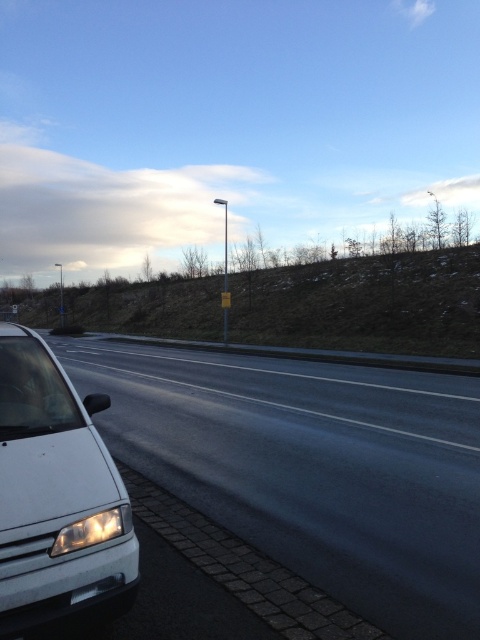
Is black asphalt highway at left further to camera compared to white matte van at left?

No, black asphalt highway at left is in front of white matte van at left.

Identify the location of black asphalt highway at left. The height and width of the screenshot is (640, 480). click(312, 467).

What do you see at coordinates (312, 467) in the screenshot? Image resolution: width=480 pixels, height=640 pixels. I see `black asphalt highway at left` at bounding box center [312, 467].

The image size is (480, 640). I want to click on black asphalt highway at left, so click(x=312, y=467).

Can you confirm if black asphalt highway at left is positioned to the right of matte white headlight at lower left?

Yes, black asphalt highway at left is to the right of matte white headlight at lower left.

Which is more to the left, black asphalt highway at left or matte white headlight at lower left?

matte white headlight at lower left is more to the left.

The height and width of the screenshot is (640, 480). In order to click on black asphalt highway at left in this screenshot , I will do `click(312, 467)`.

The image size is (480, 640). In order to click on black asphalt highway at left in this screenshot , I will do `click(312, 467)`.

Does white matte van at left appear on the left side of matte white headlight at lower left?

Indeed, white matte van at left is positioned on the left side of matte white headlight at lower left.

Who is positioned more to the left, white matte van at left or matte white headlight at lower left?

Positioned to the left is white matte van at left.

Measure the distance between point (19, 365) and camera.

Point (19, 365) and camera are 11.54 feet apart.

Identify the location of white matte van at left. The image size is (480, 640). (57, 499).